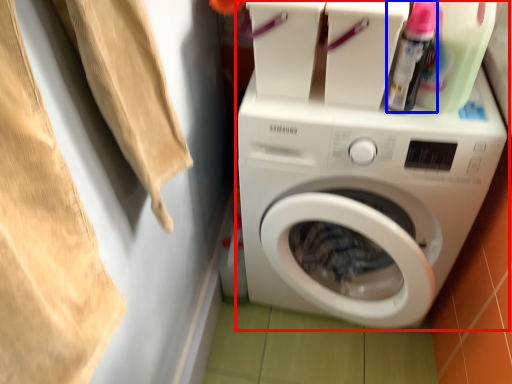
Question: Which object appears farthest to the camera in this image, washing machine (highlighted by a red box) or cleaning product (highlighted by a blue box)?

Choices:
 (A) washing machine
 (B) cleaning product

Answer: (A)